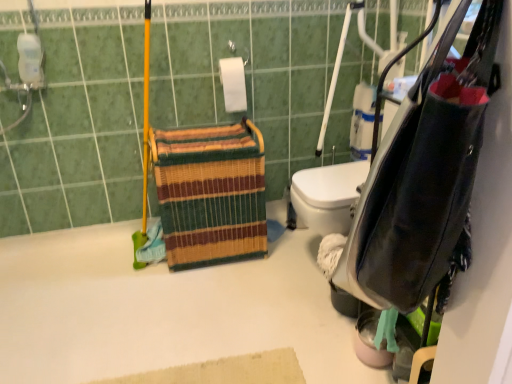
Locate an element on the screen. The width and height of the screenshot is (512, 384). vacant area in front of multicolored woven basket at center is located at coordinates (206, 301).